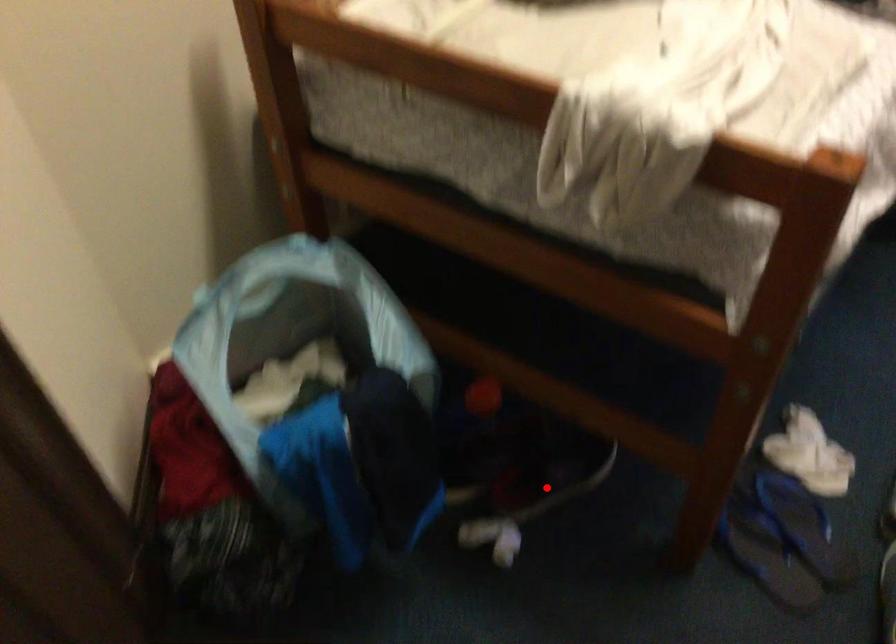
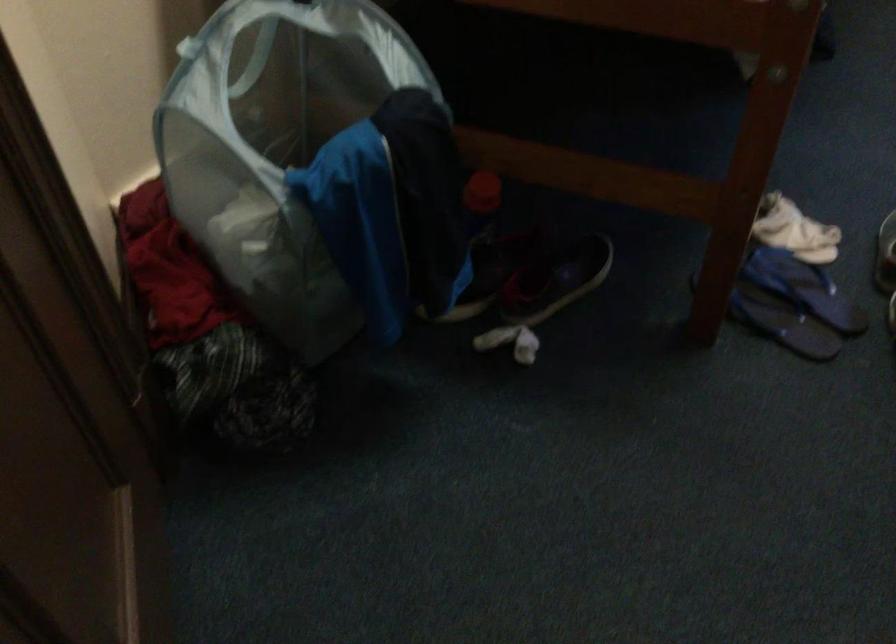
In the second image, find the point that corresponds to the highlighted location in the first image.

(556, 279)